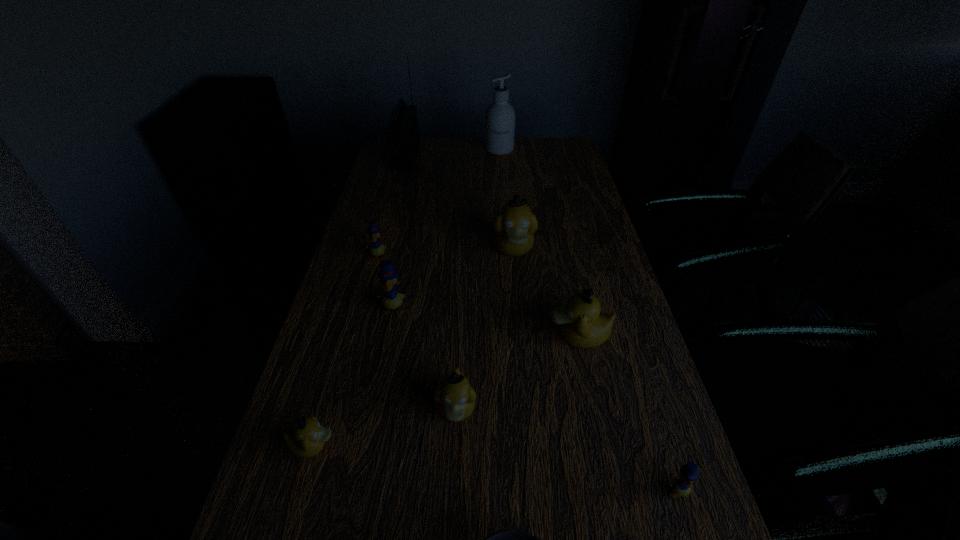
You are a GUI agent. You are given a task and a screenshot of the screen. Output one action in this format:
    pyautogui.click(x=<x>, y=<y>)
    Task: Click on the second smallest tan duckling
    
    Given the screenshot: What is the action you would take?
    pyautogui.click(x=455, y=398)

Locate an element on the screen. The image size is (960, 540). the fourth duckling from right to left is located at coordinates (455, 398).

Identify the location of the leftmost tan duckling. (307, 439).

Identify the location of the nearest duckling. The image size is (960, 540). (681, 485).

In order to click on the rightmost object in this screenshot , I will do `click(681, 485)`.

The image size is (960, 540). In order to click on blank space located on the front panel of the radio receiver in this screenshot , I will do `click(490, 157)`.

What are the coordinates of `vacant region located 0.400m on the front label of the cleansing agent` in the screenshot? It's located at (504, 213).

At what (x,y) coordinates should I click in order to perform the action: click on vacant space situated 0.140m on the face of the third tallest object. Please return your answer as a coordinate pair (x, y). The height and width of the screenshot is (540, 960). Looking at the image, I should click on (518, 303).

Locate an element on the screen. The image size is (960, 540). vacant space located 0.390m on the face of the third smallest tan duckling is located at coordinates (384, 336).

Identify the location of free space located on the face of the third smallest tan duckling. The height and width of the screenshot is (540, 960). (447, 336).